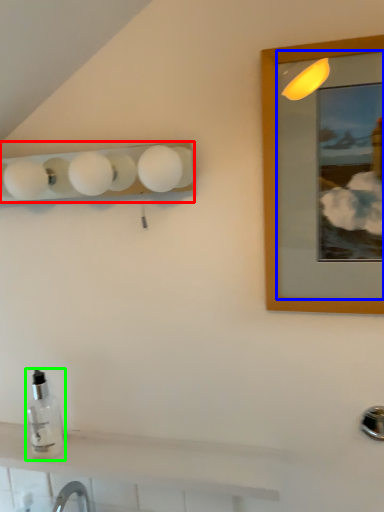
Question: Based on their relative distances, which object is farther from lamp (highlighted by a red box)? Choose from mirror (highlighted by a blue box) and bottle (highlighted by a green box).

Choices:
 (A) mirror
 (B) bottle

Answer: (B)